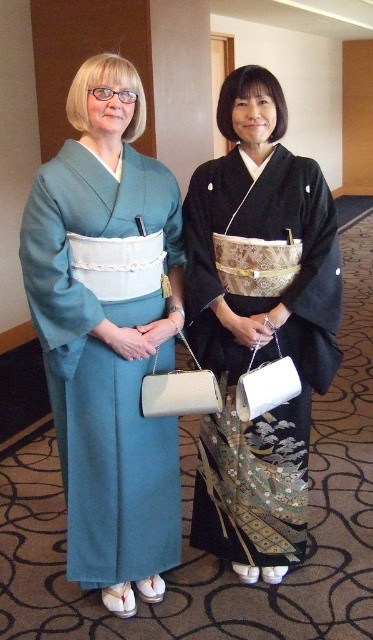
Question: Is teal silk kimono at left to the right of black silk kimono at center from the viewer's perspective?

Choices:
 (A) no
 (B) yes

Answer: (A)

Question: Does teal silk kimono at left have a greater width compared to black silk kimono at center?

Choices:
 (A) yes
 (B) no

Answer: (B)

Question: Which point is farther to the camera?

Choices:
 (A) teal silk kimono at left
 (B) black silk kimono at center

Answer: (B)

Question: Is teal silk kimono at left thinner than black silk kimono at center?

Choices:
 (A) no
 (B) yes

Answer: (B)